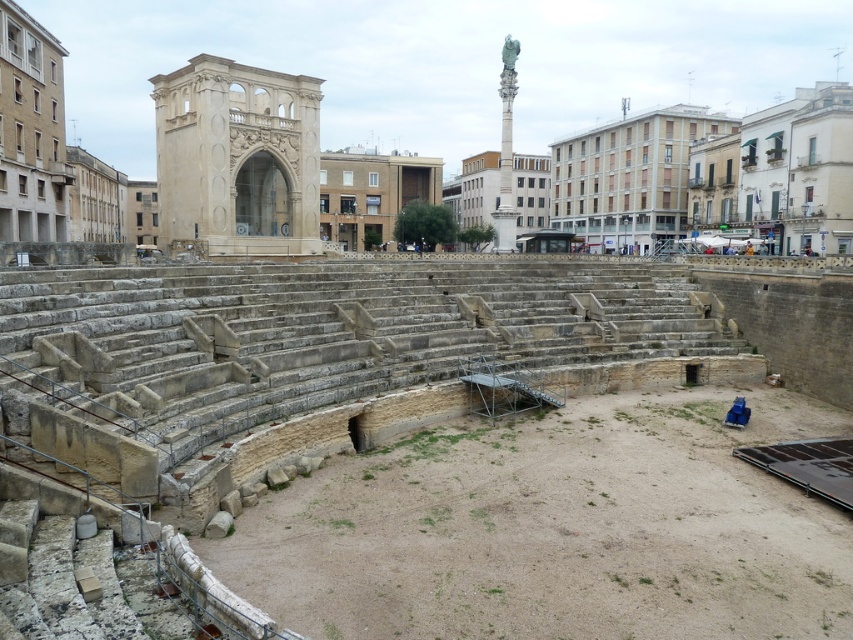
Question: Does beige stone arch at center appear on the left side of green marble column at upper center?

Choices:
 (A) no
 (B) yes

Answer: (B)

Question: Can you confirm if beige stone arch at center is positioned to the right of green marble column at upper center?

Choices:
 (A) yes
 (B) no

Answer: (B)

Question: Among these objects, which one is farthest from the camera?

Choices:
 (A) beige stone arch at center
 (B) green marble column at upper center

Answer: (B)

Question: Does beige stone arch at center appear over green marble column at upper center?

Choices:
 (A) no
 (B) yes

Answer: (A)